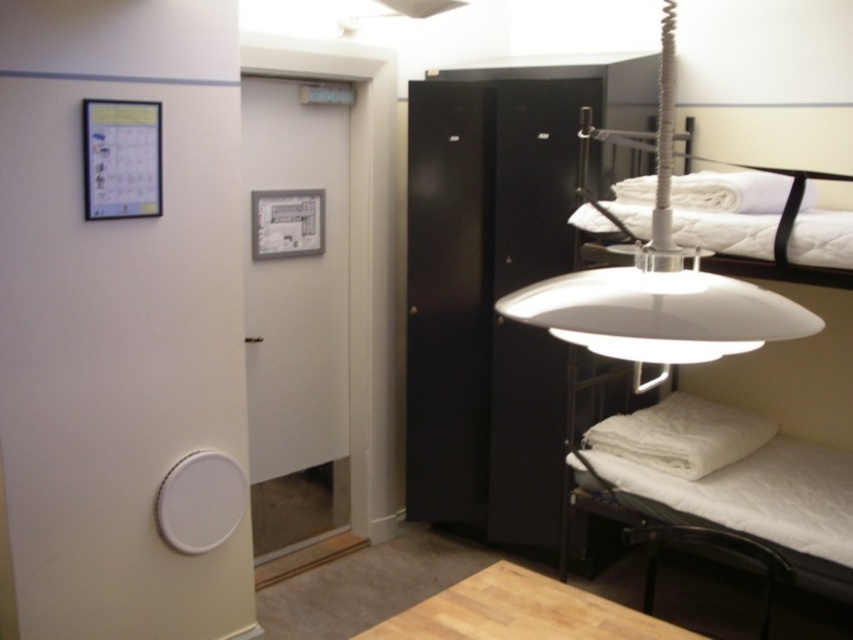
What is the spatial relationship between the white matte lampshade at upper right and the white matte bed at lower right in the room?

The white matte lampshade at upper right is behind the white matte bed at lower right.

You are a guest in this room and want to place a tall plant next to the white matte lampshade at upper right and the white quilted bed at upper right. Which object should you place it next to if you want the plant to be taller than both?

The white matte lampshade at upper right is much taller than the white quilted bed at upper right, so placing the plant next to the white matte lampshade at upper right would ensure the plant is taller than both since it needs to surpass the taller object.